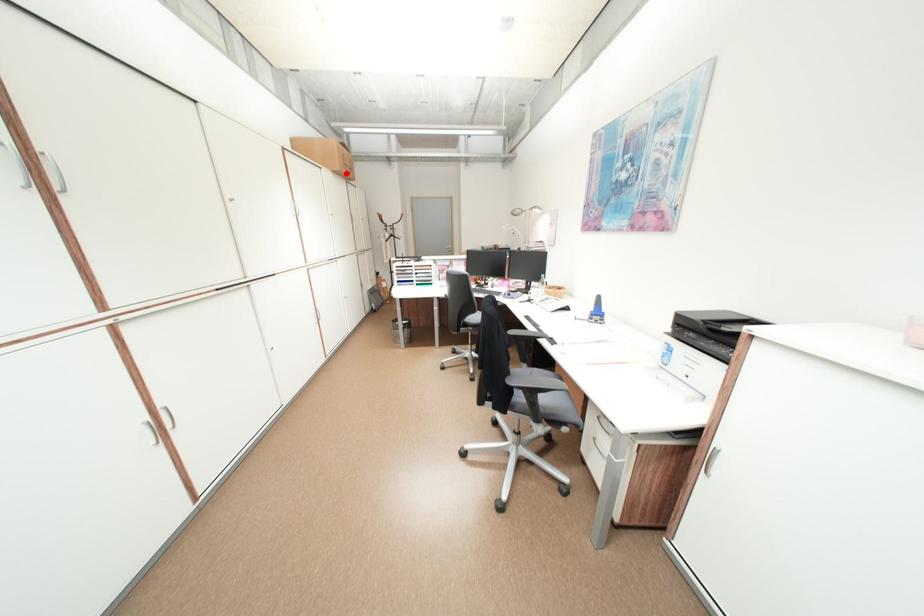
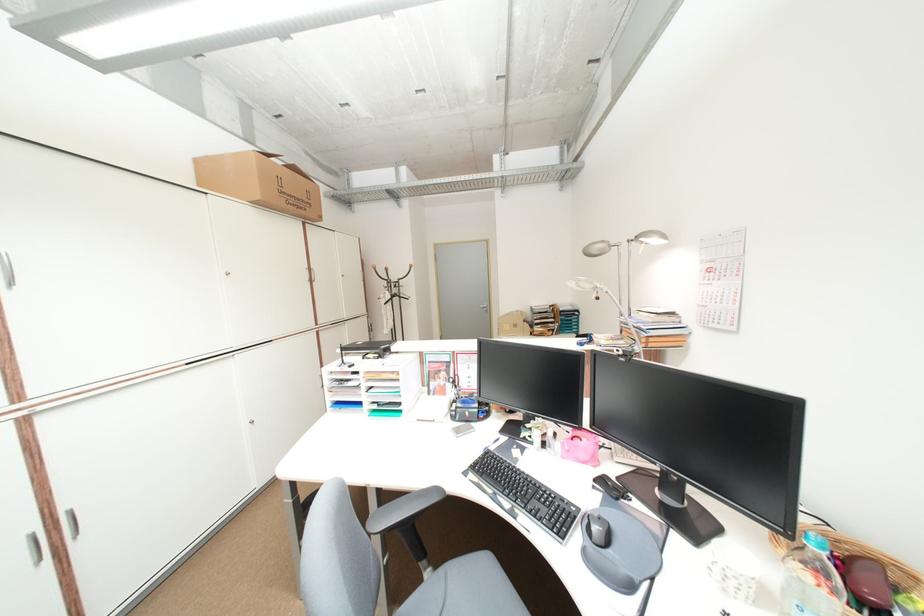
The point at the highlighted location is marked in the first image. Where is the corresponding point in the second image?

(270, 205)